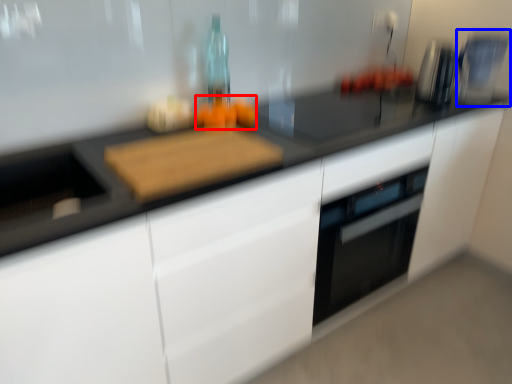
Question: Which object is closer to the camera taking this photo, food (highlighted by a red box) or coffee machine (highlighted by a blue box)?

Choices:
 (A) food
 (B) coffee machine

Answer: (A)